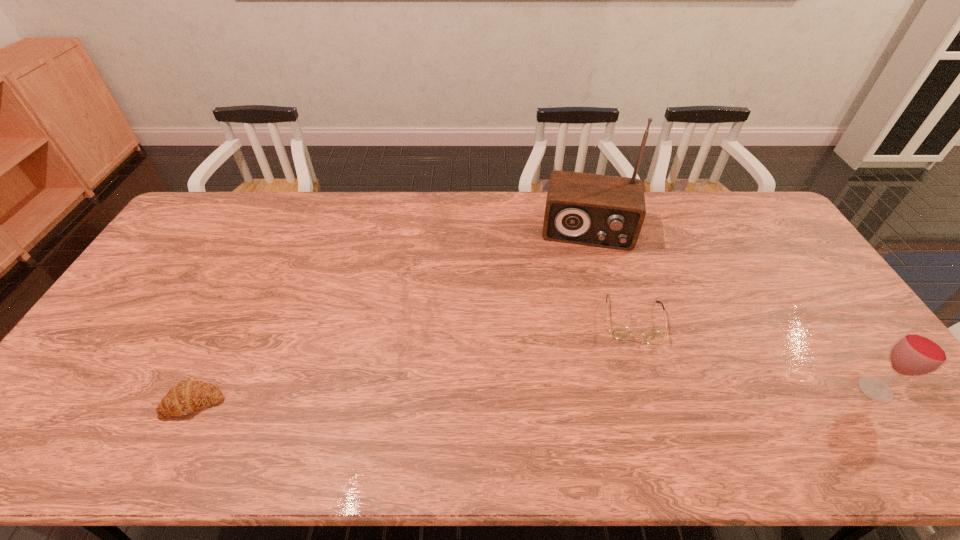
Locate an element on the screen. The height and width of the screenshot is (540, 960). the leftmost object is located at coordinates (187, 396).

You are a GUI agent. You are given a task and a screenshot of the screen. Output one action in this format:
    pyautogui.click(x=<x>, y=<y>)
    Task: Click on the rightmost object
    
    Given the screenshot: What is the action you would take?
    pyautogui.click(x=917, y=352)

Where is `wineglass`? Image resolution: width=960 pixels, height=540 pixels. wineglass is located at coordinates (917, 352).

Locate an element on the screen. the third nearest object is located at coordinates (621, 332).

Where is `radio receiver`? This screenshot has width=960, height=540. radio receiver is located at coordinates (597, 210).

The height and width of the screenshot is (540, 960). I want to click on the tallest object, so click(597, 210).

This screenshot has width=960, height=540. What are the coordinates of `vacant position located on the back of the crescent roll` in the screenshot? It's located at (252, 287).

Where is `free spot located 0.070m on the left of the rightmost object`? free spot located 0.070m on the left of the rightmost object is located at coordinates (829, 390).

Locate an element on the screen. Image resolution: width=960 pixels, height=540 pixels. vacant space located 0.070m on the lenses of the spectacles is located at coordinates (636, 367).

Identify the location of vacant space located on the lenses of the spectacles. (640, 413).